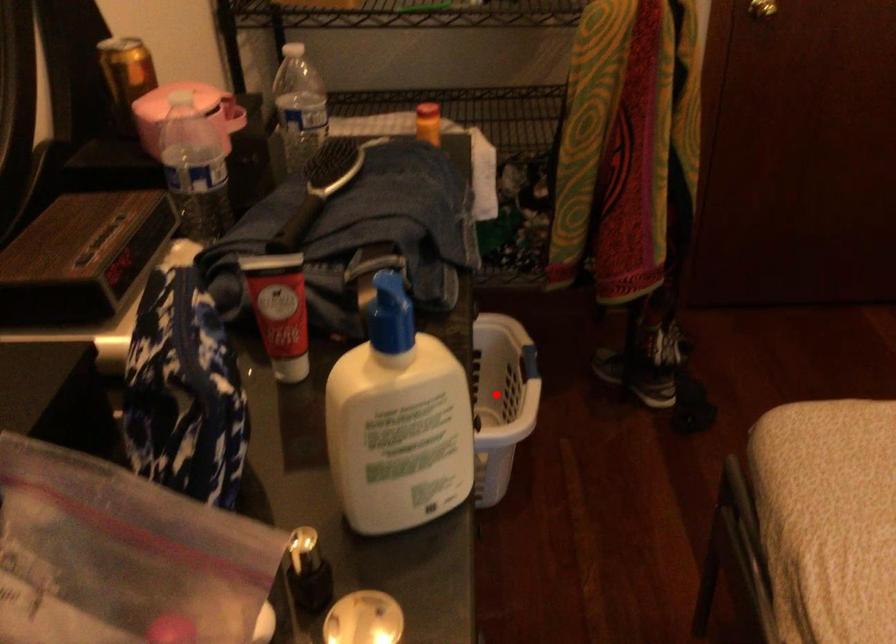
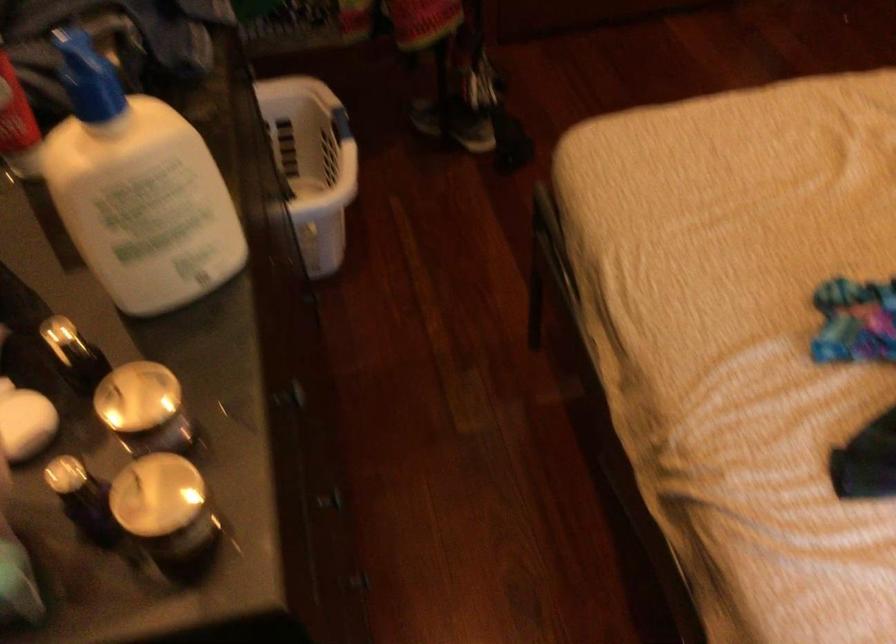
Locate, in the second image, the point that corresponds to the highlighted location in the first image.

(312, 164)